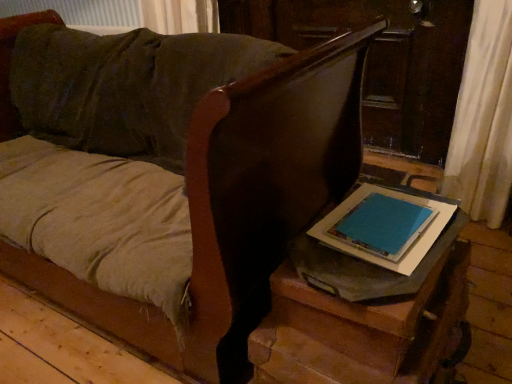
Locate an element on the screen. The height and width of the screenshot is (384, 512). free space above blue matte tablet at center (from a real-world perspective) is located at coordinates (382, 213).